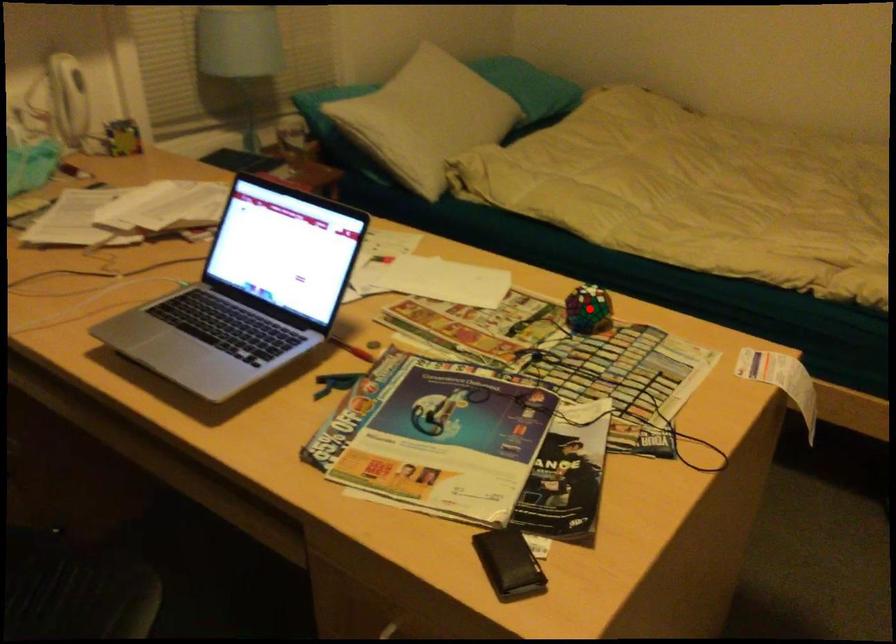
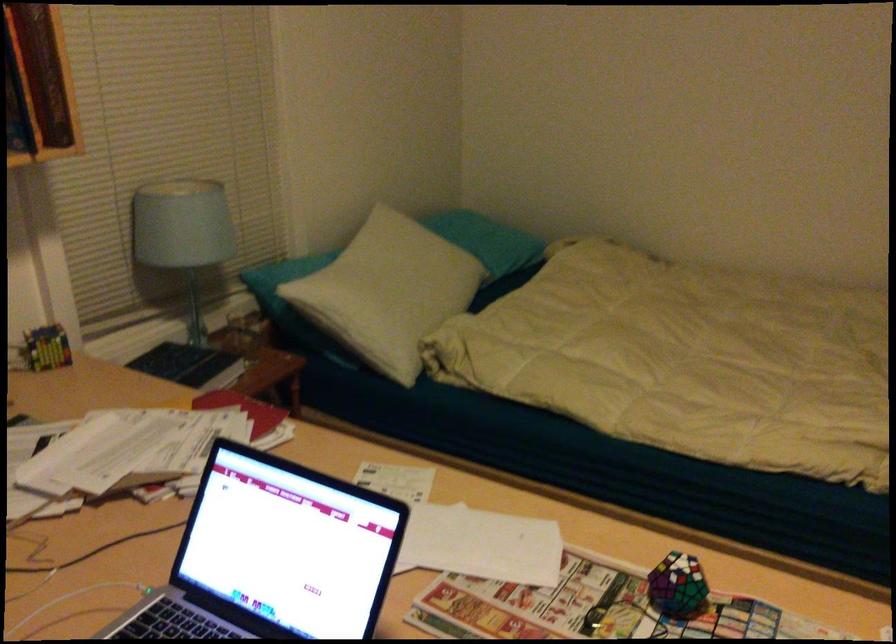
Where in the second image is the point corresponding to the highlighted location from the first image?

(677, 585)